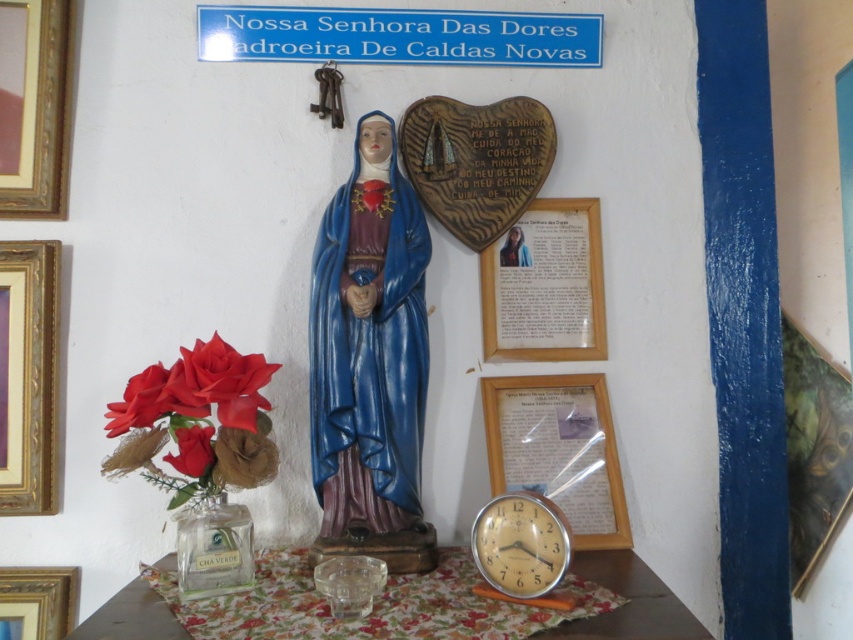
Question: Among these objects, which one is farthest from the camera?

Choices:
 (A) matte glass picture frame at lower right
 (B) blue glossy statue at center
 (C) gold-framed picture at upper left
 (D) metallic gold picture frame at right

Answer: (D)

Question: Which object is farther from the camera taking this photo?

Choices:
 (A) wooden picture frame at lower left
 (B) matte blue statue at center
 (C) blue glossy statue at center
 (D) matte plastic roses at left

Answer: (B)

Question: Does matte plastic roses at left come in front of wooden picture frame at lower left?

Choices:
 (A) yes
 (B) no

Answer: (A)

Question: Does gold-framed picture at upper left have a lesser width compared to metallic gold picture frame at right?

Choices:
 (A) yes
 (B) no

Answer: (A)

Question: In this image, where is matte plastic roses at left located relative to matte blue statue at center?

Choices:
 (A) right
 (B) left

Answer: (B)

Question: Which object appears closest to the camera in this image?

Choices:
 (A) matte plastic rose at left
 (B) matte plastic roses at left
 (C) wooden table at center

Answer: (C)